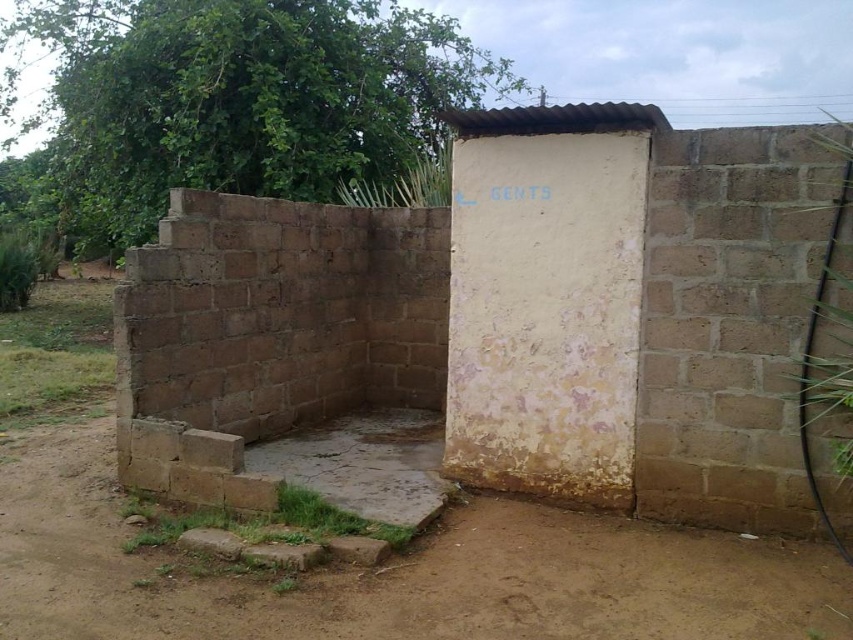
Is white painted brick toilet at center thinner than brown dirt field at lower left?

Yes, white painted brick toilet at center is thinner than brown dirt field at lower left.

Does white painted brick toilet at center appear under brown dirt field at lower left?

No.

Which is behind, point (532, 145) or point (799, 596)?

The point (532, 145) is behind.

Find the location of a particular element. white painted brick toilet at center is located at coordinates (515, 312).